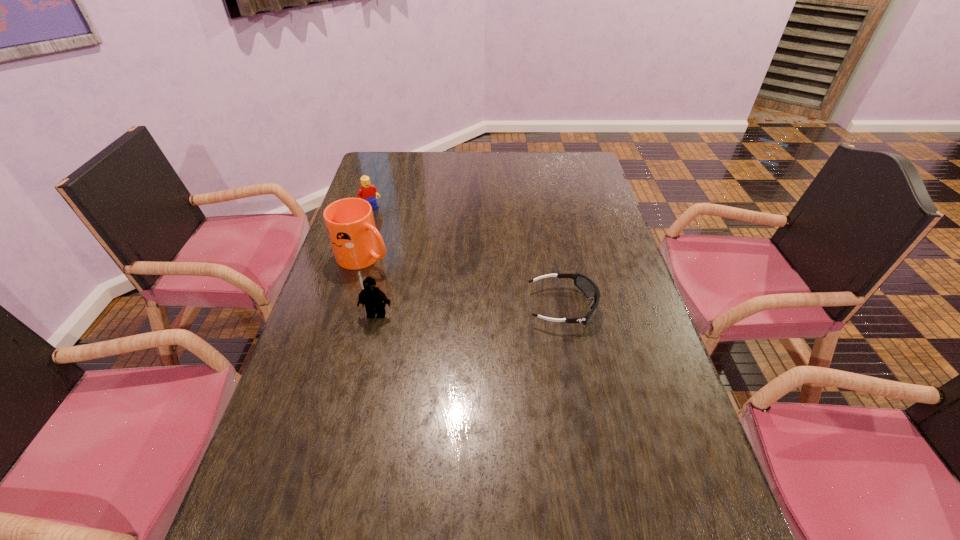
Where is `vacant space on the desktop that is between the right Lego and the shortest object and is positioned on the handle side of the third nearest object`? vacant space on the desktop that is between the right Lego and the shortest object and is positioned on the handle side of the third nearest object is located at coordinates (481, 310).

The width and height of the screenshot is (960, 540). I want to click on free space on the desktop that is between the right Lego and the rightmost object and is positioned on the face of the farther Lego, so click(466, 310).